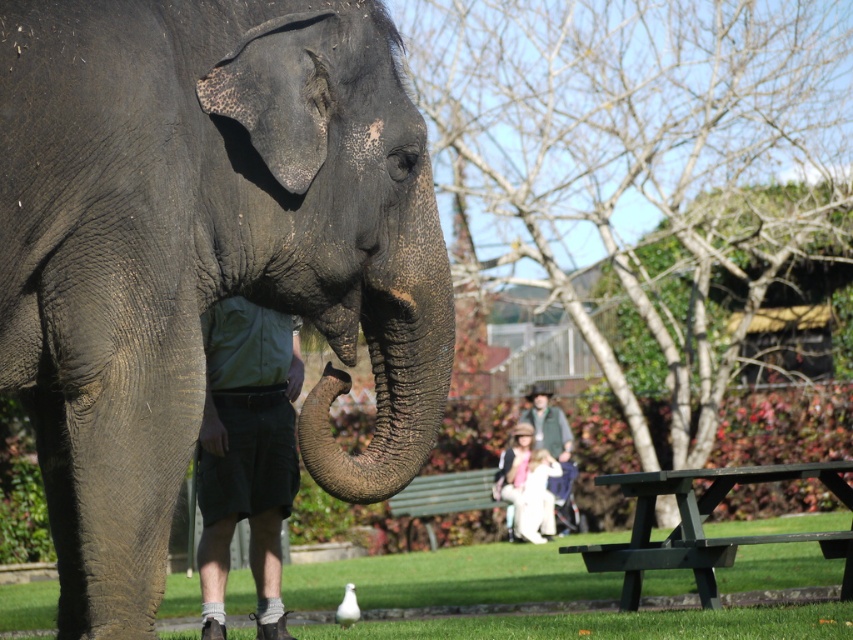
You are standing at the point marked by the coordinates point (444, 497). What is located directly beneath your feet?

The point (444, 497) is on green wooden bench at lower center, so the location directly beneath your feet is the green wooden bench at lower center.

You are standing in the park and want to take a photo of the green grass at lower center and the green fabric shorts at lower left. Which object should you focus on first to ensure both are in clear view?

The green grass at lower center is closer to the viewer than the green fabric shorts at lower left, so you should focus on the green grass at lower center first to ensure both are in clear view.